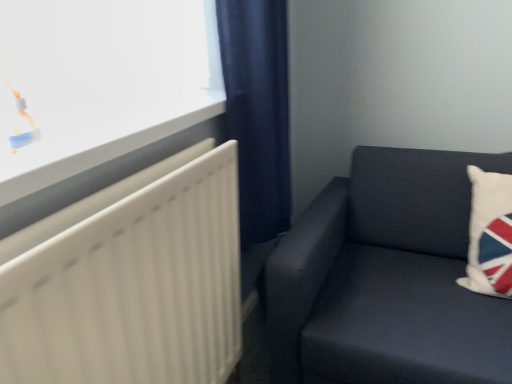
Question: Is white glossy window at upper left thinner than white fabric pillow at right?

Choices:
 (A) yes
 (B) no

Answer: (B)

Question: Can you confirm if white glossy window at upper left is positioned to the right of white fabric pillow at right?

Choices:
 (A) yes
 (B) no

Answer: (B)

Question: From a real-world perspective, is white glossy window at upper left physically below white fabric pillow at right?

Choices:
 (A) yes
 (B) no

Answer: (B)

Question: Is white fabric pillow at right inside white glossy window at upper left?

Choices:
 (A) no
 (B) yes

Answer: (A)

Question: Could you tell me if white glossy window at upper left is facing white fabric pillow at right?

Choices:
 (A) yes
 (B) no

Answer: (B)

Question: From a real-world perspective, is white glossy window at upper left above or below dark fabric couch at right?

Choices:
 (A) below
 (B) above

Answer: (B)

Question: Visually, is white glossy window at upper left positioned to the left or to the right of dark fabric couch at right?

Choices:
 (A) left
 (B) right

Answer: (A)

Question: Considering the positions of point (156, 74) and point (385, 241), is point (156, 74) closer or farther from the camera than point (385, 241)?

Choices:
 (A) closer
 (B) farther

Answer: (A)

Question: In terms of height, does white glossy window at upper left look taller or shorter compared to dark fabric couch at right?

Choices:
 (A) short
 (B) tall

Answer: (A)

Question: Is navy blue fabric curtain at center wider or thinner than white fabric pillow at right?

Choices:
 (A) wide
 (B) thin

Answer: (B)

Question: Is navy blue fabric curtain at center bigger or smaller than white fabric pillow at right?

Choices:
 (A) big
 (B) small

Answer: (A)

Question: From a real-world perspective, relative to white fabric pillow at right, is navy blue fabric curtain at center vertically above or below?

Choices:
 (A) below
 (B) above

Answer: (B)

Question: Considering the positions of navy blue fabric curtain at center and white fabric pillow at right in the image, is navy blue fabric curtain at center taller or shorter than white fabric pillow at right?

Choices:
 (A) tall
 (B) short

Answer: (A)

Question: From a real-world perspective, is white glossy window at upper left physically located above or below white matte radiator at left?

Choices:
 (A) below
 (B) above

Answer: (B)

Question: From the image's perspective, is white glossy window at upper left positioned above or below white matte radiator at left?

Choices:
 (A) below
 (B) above

Answer: (B)